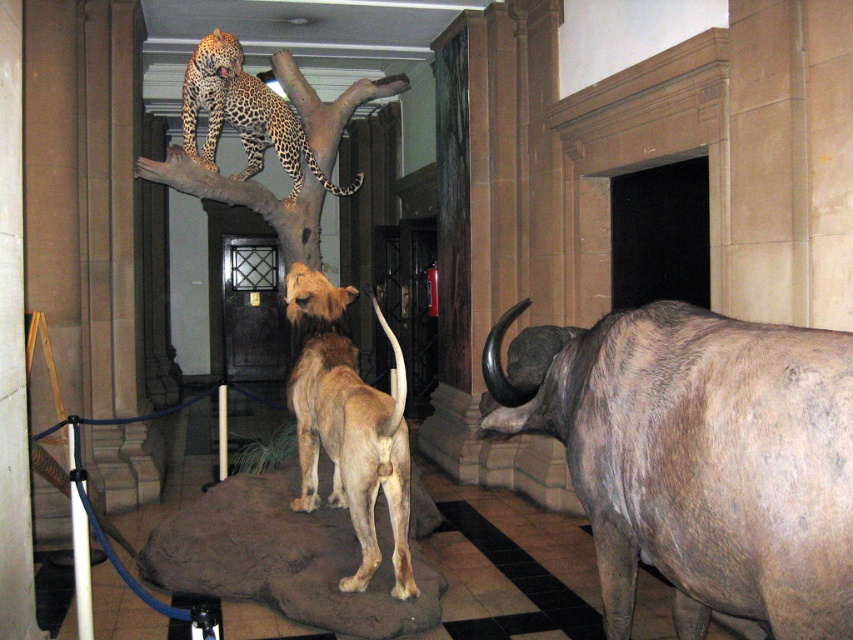
Which is more to the right, grayish-brown textured buffalo at right or spotted fur leopard at upper center?

grayish-brown textured buffalo at right

Is grayish-brown textured buffalo at right wider than spotted fur leopard at upper center?

No.

Who is more forward, (822, 339) or (207, 51)?

Point (822, 339) is in front.

This screenshot has width=853, height=640. I want to click on grayish-brown textured buffalo at right, so click(x=708, y=464).

Between golden-brown fur lion at center and spotted fur leopard at upper center, which one is positioned higher?

spotted fur leopard at upper center is higher up.

Can you confirm if golden-brown fur lion at center is positioned to the left of spotted fur leopard at upper center?

No, golden-brown fur lion at center is not to the left of spotted fur leopard at upper center.

What do you see at coordinates (347, 426) in the screenshot? This screenshot has width=853, height=640. I see `golden-brown fur lion at center` at bounding box center [347, 426].

Locate an element on the screen. golden-brown fur lion at center is located at coordinates (347, 426).

Which of these two, grayish-brown textured buffalo at right or golden-brown fur lion at center, stands taller?

Standing taller between the two is golden-brown fur lion at center.

Is grayish-brown textured buffalo at right bigger than golden-brown fur lion at center?

No, grayish-brown textured buffalo at right is not bigger than golden-brown fur lion at center.

Identify the location of grayish-brown textured buffalo at right. The width and height of the screenshot is (853, 640). (708, 464).

The width and height of the screenshot is (853, 640). Identify the location of grayish-brown textured buffalo at right. (708, 464).